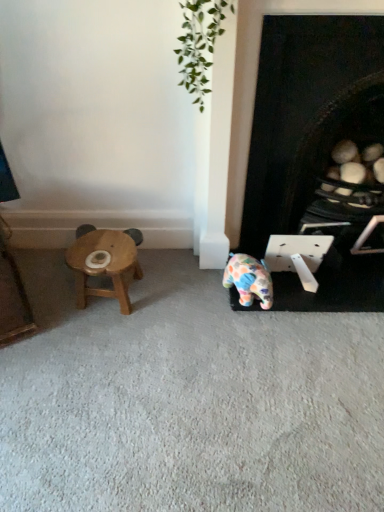
Question: Is polka dot ceramic elephant at center wider or thinner than wooden stool at left?

Choices:
 (A) wide
 (B) thin

Answer: (B)

Question: Is polka dot ceramic elephant at center inside or outside of wooden stool at left?

Choices:
 (A) inside
 (B) outside

Answer: (B)

Question: Estimate the real-world distances between objects in this image. Which object is closer to the wooden stool at left?

Choices:
 (A) polka dot ceramic elephant at center
 (B) black matte fireplace at lower right

Answer: (A)

Question: Estimate the real-world distances between objects in this image. Which object is farther from the black matte fireplace at lower right?

Choices:
 (A) polka dot ceramic elephant at center
 (B) wooden stool at left

Answer: (B)